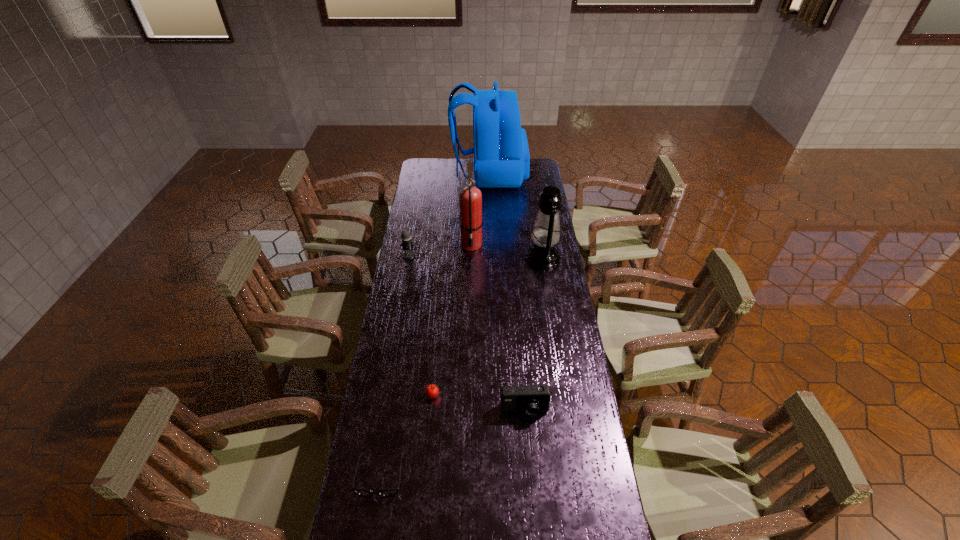
Locate an element on the screen. free spot that satisfies the following two spatial constraints: 1. on the back side of the oil lamp; 2. on the right side of the cherry is located at coordinates (444, 258).